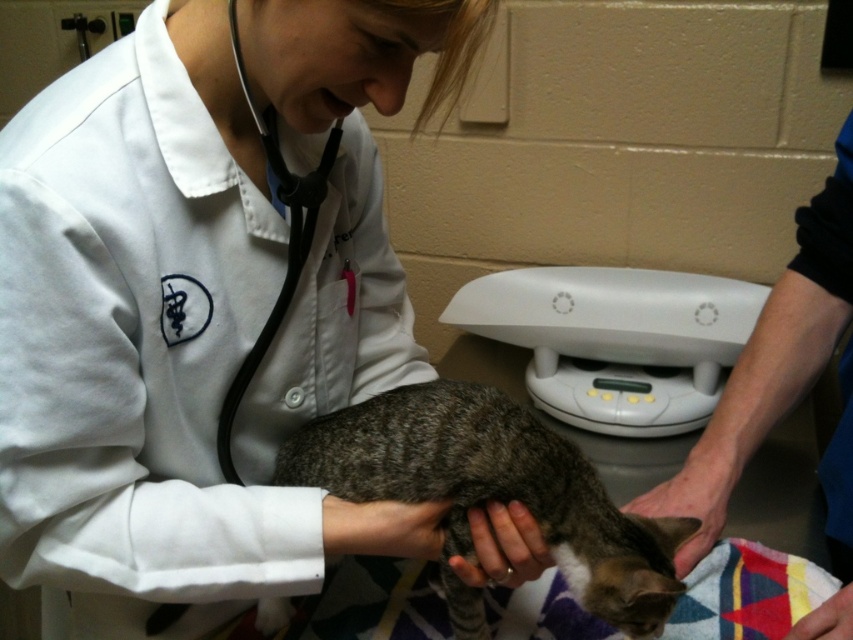
Between point (347, 221) and point (838, 438), which one is positioned in front?

Point (347, 221)

Does white smooth coat at center have a greater height compared to white coat at center?

Indeed, white smooth coat at center has a greater height compared to white coat at center.

Does point (380, 45) come in front of point (763, 376)?

Yes, it is in front of point (763, 376).

Find the location of a particular element. The image size is (853, 640). white smooth coat at center is located at coordinates (200, 307).

Can you confirm if gray striped fur cat at center is positioned to the left of white coat at center?

Indeed, gray striped fur cat at center is positioned on the left side of white coat at center.

This screenshot has height=640, width=853. Describe the element at coordinates (492, 493) in the screenshot. I see `gray striped fur cat at center` at that location.

Is point (457, 438) farther from viewer compared to point (758, 330)?

No, (457, 438) is closer to viewer.

The image size is (853, 640). What are the coordinates of `gray striped fur cat at center` in the screenshot? It's located at (492, 493).

Looking at this image, which of these two, gray striped fur cat at center or black rubber stethoscope at center, stands shorter?

gray striped fur cat at center

Is gray striped fur cat at center wider than black rubber stethoscope at center?

Correct, the width of gray striped fur cat at center exceeds that of black rubber stethoscope at center.

Who is more forward, (604, 611) or (274, 330)?

Point (604, 611) is more forward.

This screenshot has width=853, height=640. Identify the location of gray striped fur cat at center. (492, 493).